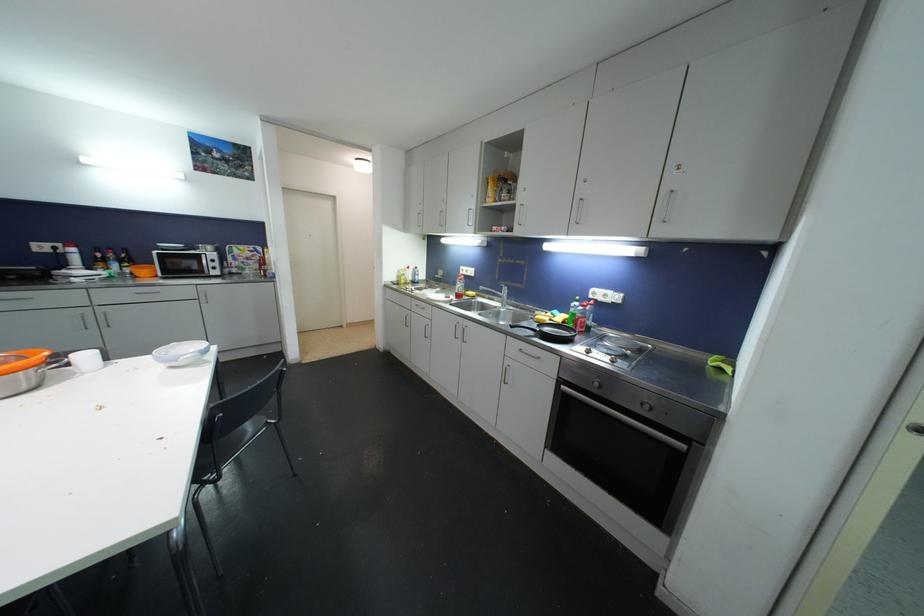
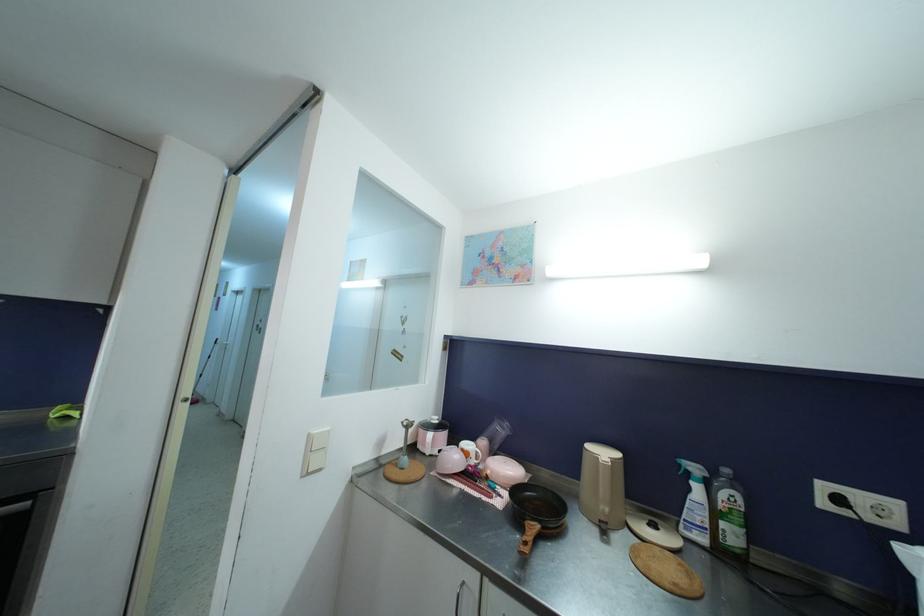
Question: The camera is either moving clockwise (left) or counter-clockwise (right) around the object. The first image is from the beginning of the video and the second image is from the end. Is the camera moving left or right when shooting the video?

Choices:
 (A) Left
 (B) Right

Answer: (A)